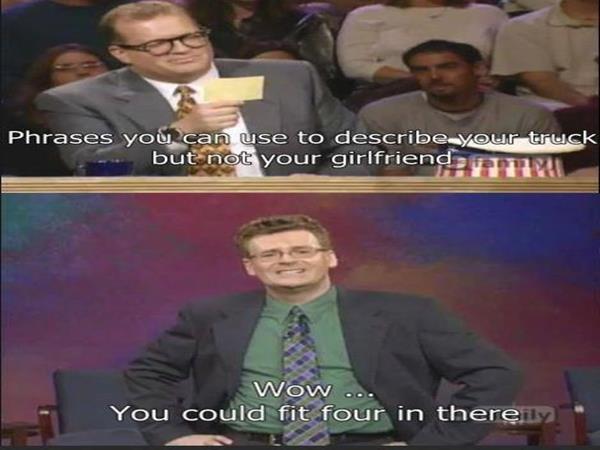
At what (x,y) coordinates should I click in order to perform the action: click on arm rest. Please return your answer as a coordinate pair (x, y). This screenshot has width=600, height=450. Looking at the image, I should click on (47, 422).